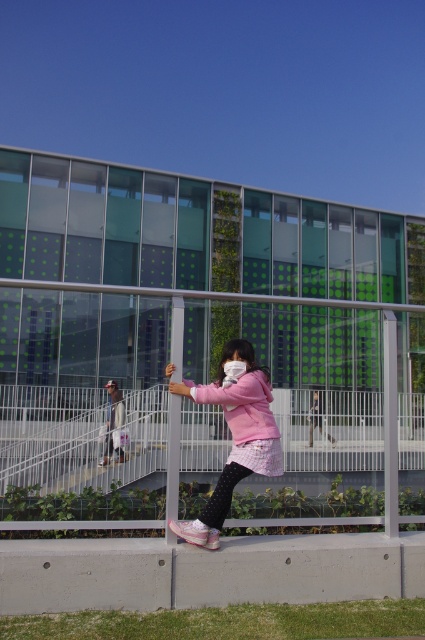
Question: Can you confirm if pink matte jacket at center is smaller than light pink fabric jacket at center?

Choices:
 (A) yes
 (B) no

Answer: (A)

Question: Can you confirm if pink matte jacket at center is positioned below light pink fabric jacket at center?

Choices:
 (A) no
 (B) yes

Answer: (A)

Question: Does pink matte jacket at center have a lesser width compared to light pink fabric jacket at center?

Choices:
 (A) yes
 (B) no

Answer: (B)

Question: Which point is farther from the camera taking this photo?

Choices:
 (A) (261, 460)
 (B) (108, 454)

Answer: (B)